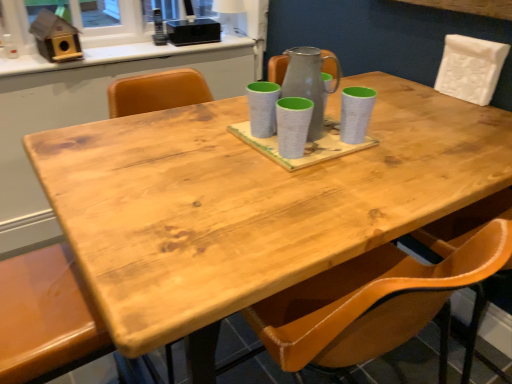
Locate an element on the screen. The width and height of the screenshot is (512, 384). vacant space that's between white matte chair at upper right, the 1th chair from the top, and matte gray pitcher at center is located at coordinates (414, 115).